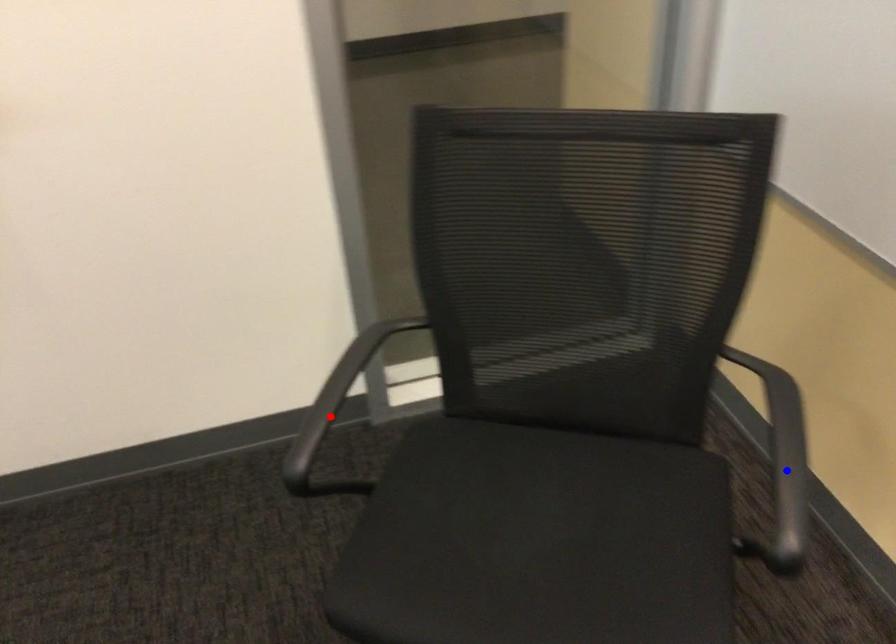
Question: Which of the two points in the image is closer to the camera?

Choices:
 (A) Blue point is closer.
 (B) Red point is closer.

Answer: (A)